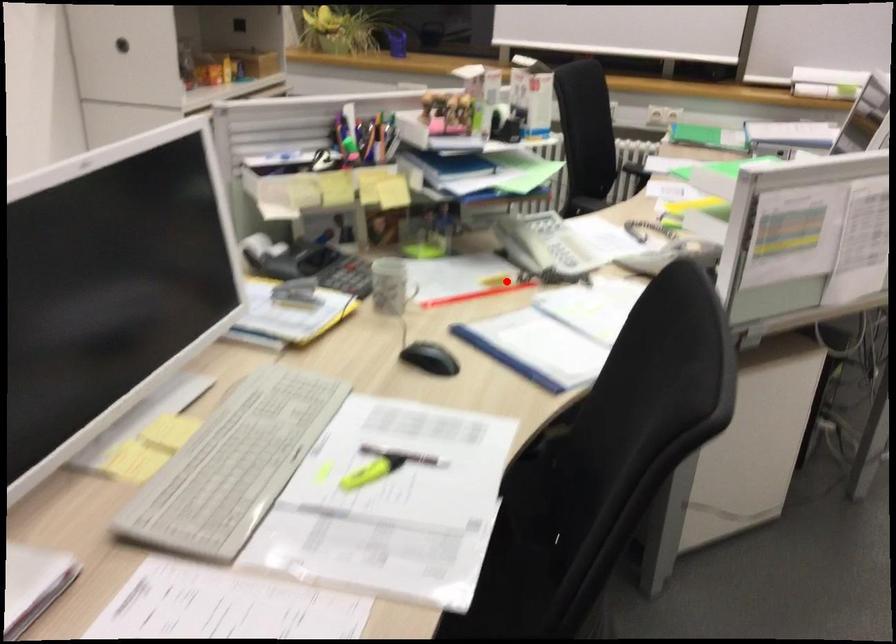
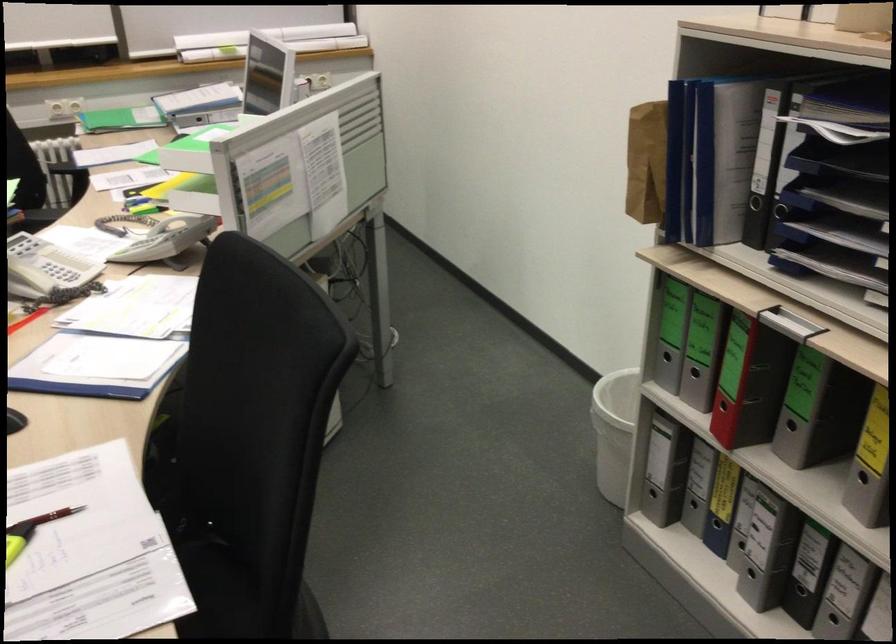
Locate, in the second image, the point that corresponds to the highlighted location in the first image.

(26, 319)